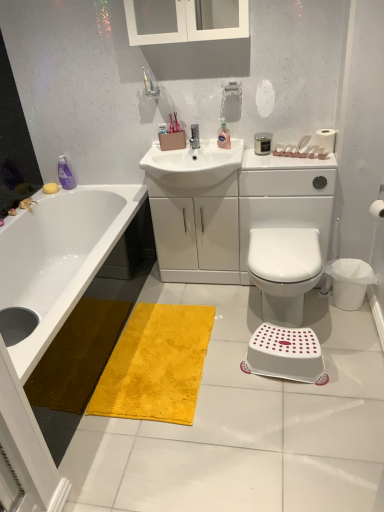
What do you see at coordinates (186, 26) in the screenshot? Image resolution: width=384 pixels, height=512 pixels. I see `white glass medicine cabinet at upper center` at bounding box center [186, 26].

The width and height of the screenshot is (384, 512). What do you see at coordinates (65, 174) in the screenshot? I see `purple glossy bottle at upper left, the first toiletry viewed from the back` at bounding box center [65, 174].

What is the approximate width of white matte toilet paper at right, the second toilet paper positioned from the back?

white matte toilet paper at right, the second toilet paper positioned from the back, is 9.28 centimeters wide.

Identify the location of satin black candle at upper right, positioned as the first toiletry in right-to-left order. The image size is (384, 512). (262, 143).

In order to face matte silver faucet at center, should I rotate leftwards or rightwards?

To face it directly, rotate right by 0.214 degrees.

Where is `matte silver faucet at center`? Image resolution: width=384 pixels, height=512 pixels. matte silver faucet at center is located at coordinates (194, 136).

Describe the element at coordinates (59, 257) in the screenshot. I see `matte white bathtub at left` at that location.

The image size is (384, 512). I want to click on translucent plastic soap dispenser at upper center, acting as the 2th toiletry starting from the left, so click(x=223, y=136).

Where is `white glass medicine cabinet at upper center`? The image size is (384, 512). white glass medicine cabinet at upper center is located at coordinates (186, 26).

Does purple glossy bottle at upper left, the 3th toiletry in the front-to-back sequence, appear on the left side of yellow plush rug at center?

Yes, purple glossy bottle at upper left, the 3th toiletry in the front-to-back sequence, is to the left of yellow plush rug at center.

Can you tell me how much purple glossy bottle at upper left, the 3th toiletry in the front-to-back sequence, and yellow plush rug at center differ in facing direction?

89.9 degrees.

Is yellow plush rug at center located within purple glossy bottle at upper left, arranged as the third toiletry when viewed from the right?

No, yellow plush rug at center is located outside of purple glossy bottle at upper left, arranged as the third toiletry when viewed from the right.

Is purple glossy bottle at upper left, arranged as the third toiletry when viewed from the right, in front of or behind yellow plush rug at center in the image?

In the image, purple glossy bottle at upper left, arranged as the third toiletry when viewed from the right, appears behind yellow plush rug at center.

This screenshot has height=512, width=384. Find the location of `medicine cabinet behind the matte white bathtub at left`. medicine cabinet behind the matte white bathtub at left is located at coordinates (186, 26).

Is there a large distance between white glass medicine cabinet at upper center and matte white bathtub at left?

Indeed, white glass medicine cabinet at upper center is not near matte white bathtub at left.

Which object is positioned more to the left, white glass medicine cabinet at upper center or matte white bathtub at left?

matte white bathtub at left is more to the left.

Is white glass medicine cabinet at upper center turned away from matte white bathtub at left?

white glass medicine cabinet at upper center is not turned away from matte white bathtub at left.

Does point (51, 300) lie in front of point (288, 244)?

No, (51, 300) is behind (288, 244).

Would you say matte white bathtub at left contains white plastic bidet at center?

That's incorrect, white plastic bidet at center is not inside matte white bathtub at left.

Who is bigger, matte white bathtub at left or white plastic bidet at center?

Bigger between the two is matte white bathtub at left.

Considering the relative sizes of matte white bathtub at left and white plastic bidet at center in the image provided, is matte white bathtub at left wider than white plastic bidet at center?

Indeed, matte white bathtub at left has a greater width compared to white plastic bidet at center.

From their relative heights in the image, would you say white paper at upper right, placed as the 1th toilet paper when sorted from back to front, is taller or shorter than white glossy sink at center?

white paper at upper right, placed as the 1th toilet paper when sorted from back to front, is shorter than white glossy sink at center.

Is white paper at upper right, placed as the 1th toilet paper when sorted from back to front, at the right side of white glossy sink at center?

Correct, you'll find white paper at upper right, placed as the 1th toilet paper when sorted from back to front, to the right of white glossy sink at center.

From a real-world perspective, is white paper at upper right, which appears as the 2th toilet paper when ordered from the bottom, over white glossy sink at center?

Yes.

Based on the photo, from a real-world perspective, is translucent plastic soap dispenser at upper center, arranged as the 2th toiletry when viewed from the front, positioned under white plastic bidet at center based on gravity?

Actually, translucent plastic soap dispenser at upper center, arranged as the 2th toiletry when viewed from the front, is physically above white plastic bidet at center in the real world.

From the image's perspective, is translucent plastic soap dispenser at upper center, arranged as the 2th toiletry when viewed from the front, under white plastic bidet at center?

Incorrect, from the image's perspective, translucent plastic soap dispenser at upper center, arranged as the 2th toiletry when viewed from the front, is higher than white plastic bidet at center.

Which of these two, translucent plastic soap dispenser at upper center, arranged as the 2th toiletry when viewed from the front, or white plastic bidet at center, stands taller?

white plastic bidet at center is taller.

Between yellow plush rug at center and white paper at upper right, which is counted as the second toilet paper, starting from the front, which one has smaller size?

Smaller between the two is white paper at upper right, which is counted as the second toilet paper, starting from the front.

Considering the relative sizes of yellow plush rug at center and white paper at upper right, the 1th toilet paper viewed from the top, in the image provided, is yellow plush rug at center taller than white paper at upper right, the 1th toilet paper viewed from the top,?

No, yellow plush rug at center is not taller than white paper at upper right, the 1th toilet paper viewed from the top.

Would you say yellow plush rug at center is inside or outside white paper at upper right, which is counted as the second toilet paper, starting from the front?

yellow plush rug at center cannot be found inside white paper at upper right, which is counted as the second toilet paper, starting from the front.

Is yellow plush rug at center far away from white paper at upper right, placed as the 1th toilet paper when sorted from back to front?

Indeed, yellow plush rug at center is not near white paper at upper right, placed as the 1th toilet paper when sorted from back to front.

How much distance is there between yellow matte soap at upper left and white matte toilet paper at right, which is the 2th toilet paper in left-to-right order?

The distance of yellow matte soap at upper left from white matte toilet paper at right, which is the 2th toilet paper in left-to-right order, is 1.93 meters.

Starting from the yellow matte soap at upper left, which toilet paper is the 2nd one to the right? Please provide its 2D coordinates.

[(377, 210)]

Which is in front, point (54, 184) or point (375, 214)?

The point (375, 214) is in front.

Considering the sizes of objects yellow matte soap at upper left and white matte toilet paper at right, arranged as the first toilet paper when viewed from the front, in the image provided, who is thinner, yellow matte soap at upper left or white matte toilet paper at right, arranged as the first toilet paper when viewed from the front,?

white matte toilet paper at right, arranged as the first toilet paper when viewed from the front, is thinner.

The image size is (384, 512). I want to click on doormat below the purple glossy bottle at upper left, the 3th toiletry in the front-to-back sequence (from a real-world perspective), so click(x=156, y=365).

Find the location of a particular element. The width and height of the screenshot is (384, 512). medicine cabinet that is above the matte white bathtub at left (from a real-world perspective) is located at coordinates (186, 26).

Looking at this image, estimate the real-world distances between objects in this image. Which object is closer to matte silver faucet at center, white paper at upper right, which is the first toilet paper from left to right, or yellow matte soap at upper left?

Based on the image, white paper at upper right, which is the first toilet paper from left to right, appears to be nearer to matte silver faucet at center.

Which object lies nearer to the anchor point white glass medicine cabinet at upper center, white glossy sink at center or yellow matte soap at upper left?

The object closer to white glass medicine cabinet at upper center is white glossy sink at center.

Considering their positions, is purple glossy bottle at upper left, the 3th toiletry in the front-to-back sequence, positioned further to white glass medicine cabinet at upper center than white paper at upper right, acting as the 2th toilet paper starting from the right?

purple glossy bottle at upper left, the 3th toiletry in the front-to-back sequence.

When comparing their distances from matte silver faucet at center, does white paper at upper right, which appears as the 2th toilet paper when ordered from the bottom, or yellow plush rug at center seem closer?

Among the two, white paper at upper right, which appears as the 2th toilet paper when ordered from the bottom, is located nearer to matte silver faucet at center.

Consider the image. From the image, which object appears to be nearer to matte silver faucet at center, white matte toilet paper at right, the 1th toilet paper from the right, or white glossy sink at center?

white glossy sink at center lies closer to matte silver faucet at center than the other object.

Looking at the image, which one is located further to yellow plush rug at center, white plastic step stool at lower center or white glass medicine cabinet at upper center?

white glass medicine cabinet at upper center is further to yellow plush rug at center.

Based on their spatial positions, is satin black candle at upper right, positioned as the first toiletry in right-to-left order, or white paper at upper right, placed as the 1th toilet paper when sorted from back to front, closer to yellow plush rug at center?

The object closer to yellow plush rug at center is satin black candle at upper right, positioned as the first toiletry in right-to-left order.

Estimate the real-world distances between objects in this image. Which object is closer to translucent plastic soap dispenser at upper center, acting as the 2th toiletry starting from the left, matte silver faucet at center or white plastic step stool at lower center?

matte silver faucet at center is positioned closer to the anchor translucent plastic soap dispenser at upper center, acting as the 2th toiletry starting from the left.

At what (x,y) coordinates should I click in order to perform the action: click on sink situated between purple glossy bottle at upper left, arranged as the third toiletry when viewed from the right, and satin black candle at upper right, arranged as the third toiletry when viewed from the left, from left to right. Please return your answer as a coordinate pair (x, y). The height and width of the screenshot is (512, 384). Looking at the image, I should click on (193, 164).

Locate an element on the screen. toilet paper between white paper at upper right, the 1th toilet paper viewed from the top, and white plastic step stool at lower center vertically is located at coordinates (377, 210).

Locate an element on the screen. Image resolution: width=384 pixels, height=512 pixels. toilet paper between white glossy sink at center and white matte toilet paper at right, which is the 2th toilet paper in left-to-right order, in the horizontal direction is located at coordinates (326, 139).

Find the location of a particular element. The image size is (384, 512). sink between purple glossy bottle at upper left, which ranks as the first toiletry in left-to-right order, and white matte toilet paper at right, the second toilet paper viewed from the top, from left to right is located at coordinates (193, 164).